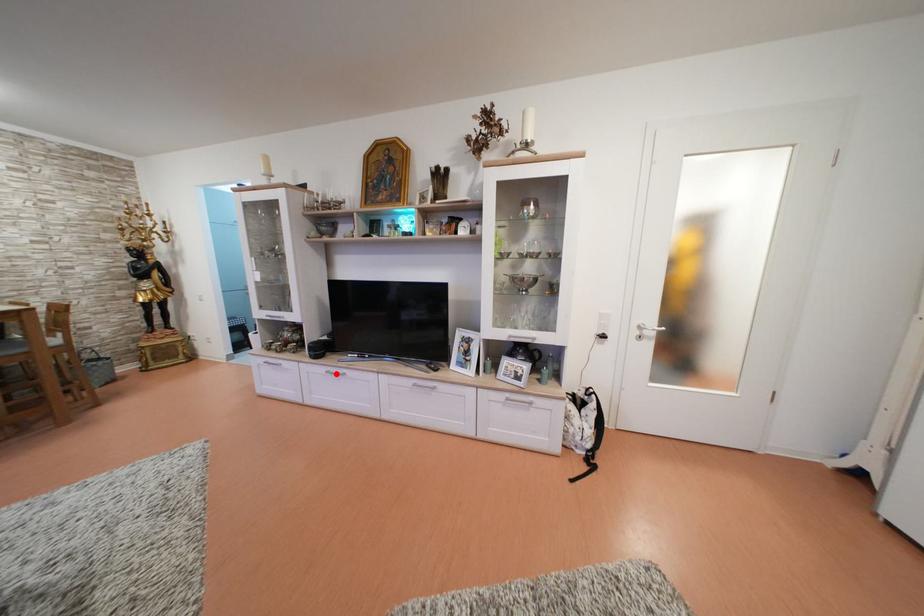
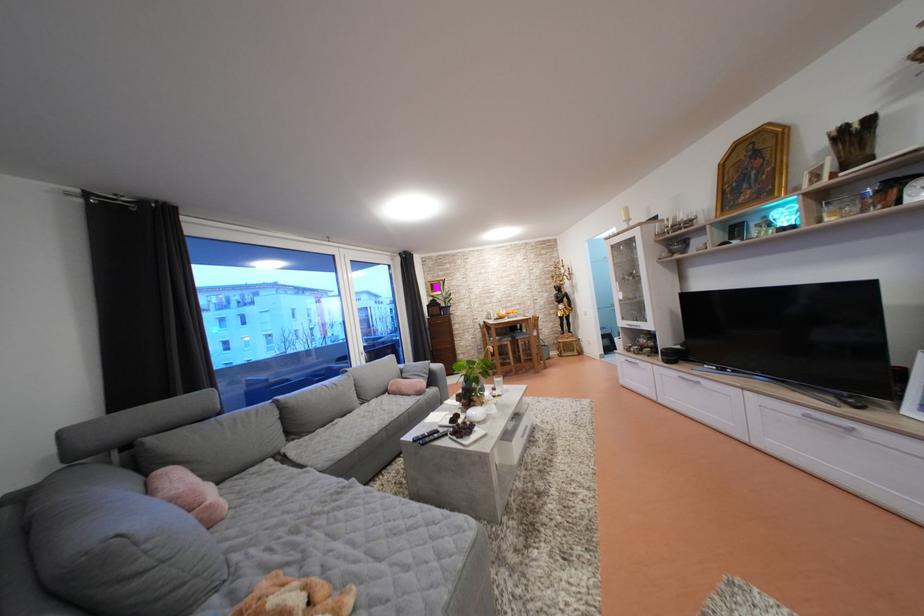
Question: A red point is marked in image1. In image2, is the corresponding 3D point closer to the camera or farther? Reply with the corresponding letter.

Choices:
 (A) The corresponding 3D point is closer.
 (B) The corresponding 3D point is farther.

Answer: (A)